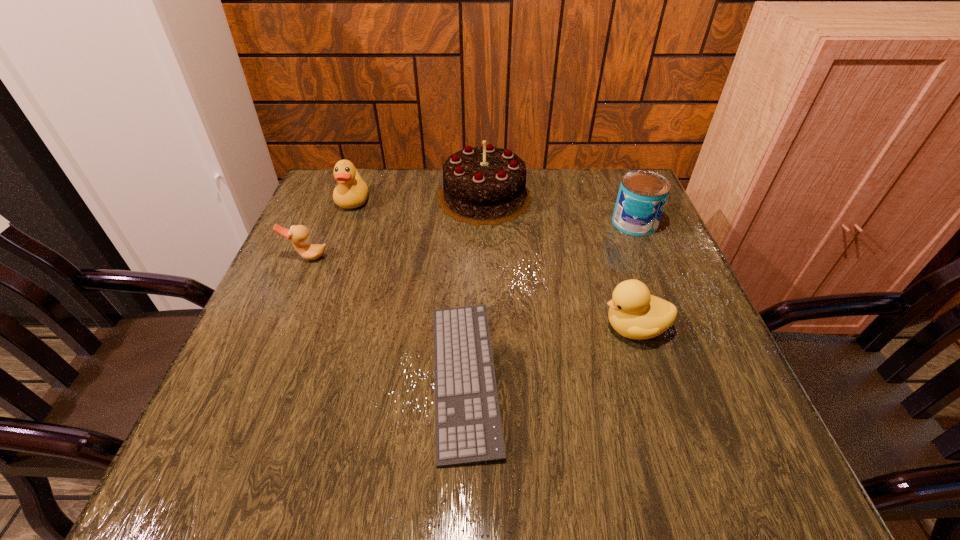
You are a GUI agent. You are given a task and a screenshot of the screen. Output one action in this format:
    pyautogui.click(x=<x>, y=<y>)
    Task: Click on the duck that stands as the second closest to the nearest duck
    
    Given the screenshot: What is the action you would take?
    pyautogui.click(x=352, y=191)

Locate an element on the screen. vacant region that satisfies the following two spatial constraints: 1. at the beak of the farthest duck; 2. on the left side of the computer keyboard is located at coordinates (289, 377).

You are a GUI agent. You are given a task and a screenshot of the screen. Output one action in this format:
    pyautogui.click(x=<x>, y=<y>)
    Task: Click on the free spot that satisfies the following two spatial constraints: 1. at the beak of the computer keyboard; 2. on the right side of the farthest duck
    The height and width of the screenshot is (540, 960).
    Given the screenshot: What is the action you would take?
    pyautogui.click(x=289, y=377)